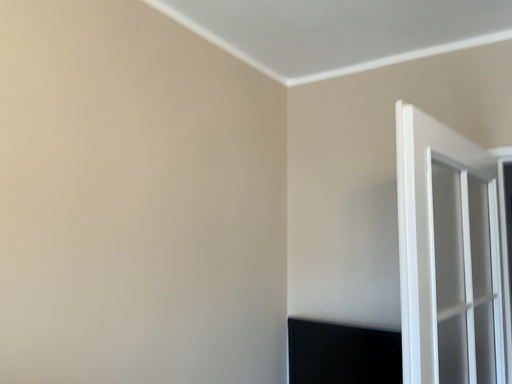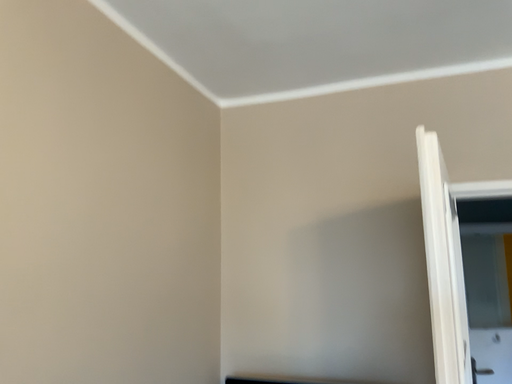
Question: Which way did the camera rotate in the video?

Choices:
 (A) rotated right
 (B) rotated left

Answer: (A)